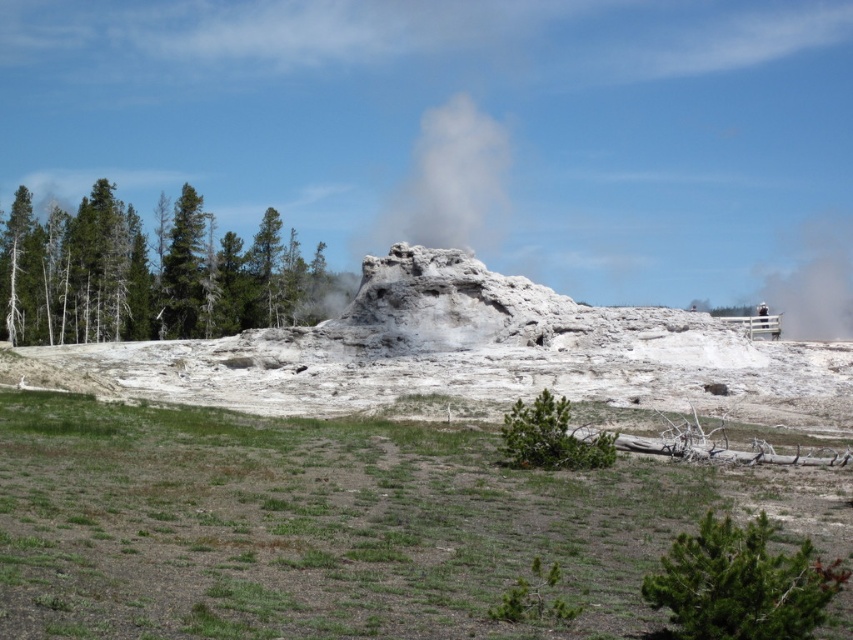
The image size is (853, 640). What do you see at coordinates (149, 273) in the screenshot?
I see `green coniferous trees at left` at bounding box center [149, 273].

Can you confirm if green coniferous trees at left is thinner than green rough bark tree at lower right?

In fact, green coniferous trees at left might be wider than green rough bark tree at lower right.

Between point (30, 221) and point (668, 556), which one is positioned in front?

Point (668, 556) is in front.

The height and width of the screenshot is (640, 853). Find the location of `green coniferous trees at left`. green coniferous trees at left is located at coordinates (149, 273).

Can you confirm if green rough bark tree at lower right is thinner than white/translucent steam at center?

Indeed, green rough bark tree at lower right has a lesser width compared to white/translucent steam at center.

Locate an element on the screen. This screenshot has width=853, height=640. green rough bark tree at lower right is located at coordinates (741, 584).

Does point (186, 289) come farther from viewer compared to point (485, 179)?

That is False.

Which is behind, point (94, 257) or point (410, 225)?

Positioned behind is point (410, 225).

Between point (86, 304) and point (489, 138), which one is positioned behind?

Positioned behind is point (489, 138).

Identify the location of green coniferous trees at left. The height and width of the screenshot is (640, 853). (149, 273).